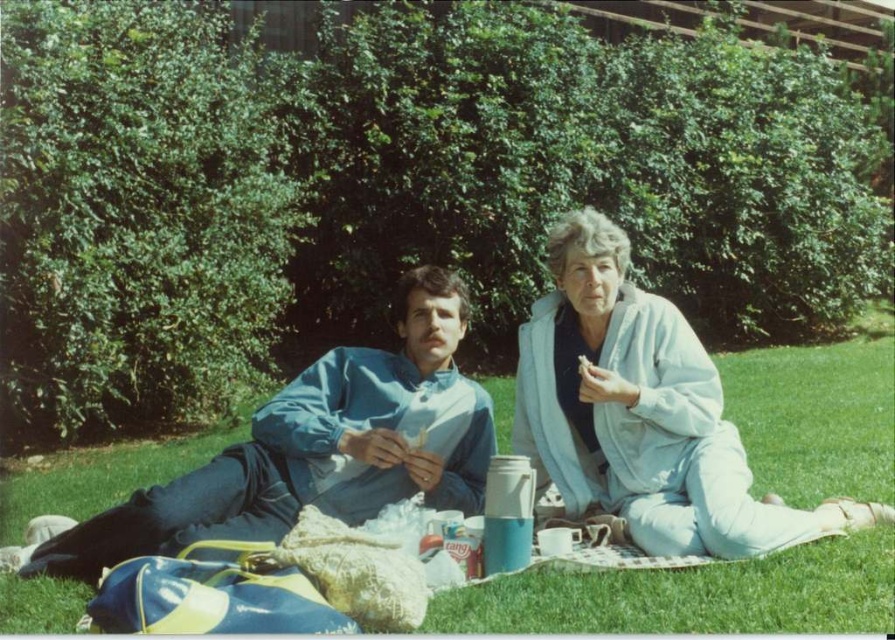
Is green grass at center to the left of blue fabric jacket at center from the viewer's perspective?

No, green grass at center is not to the left of blue fabric jacket at center.

Who is higher up, green grass at center or blue fabric jacket at center?

Positioned higher is blue fabric jacket at center.

Locate an element on the screen. green grass at center is located at coordinates (691, 595).

Describe the element at coordinates (641, 412) in the screenshot. I see `light blue fabric pants at lower right` at that location.

Which is behind, point (567, 396) or point (433, 307)?

Point (567, 396)

Find the location of `light blue fabric pants at lower right`. light blue fabric pants at lower right is located at coordinates (641, 412).

Between green grass at center and light blue fabric pants at lower right, which one appears on the right side from the viewer's perspective?

Positioned to the right is light blue fabric pants at lower right.

Does green grass at center have a greater width compared to light blue fabric pants at lower right?

Yes.

Locate an element on the screen. This screenshot has height=640, width=895. green grass at center is located at coordinates (691, 595).